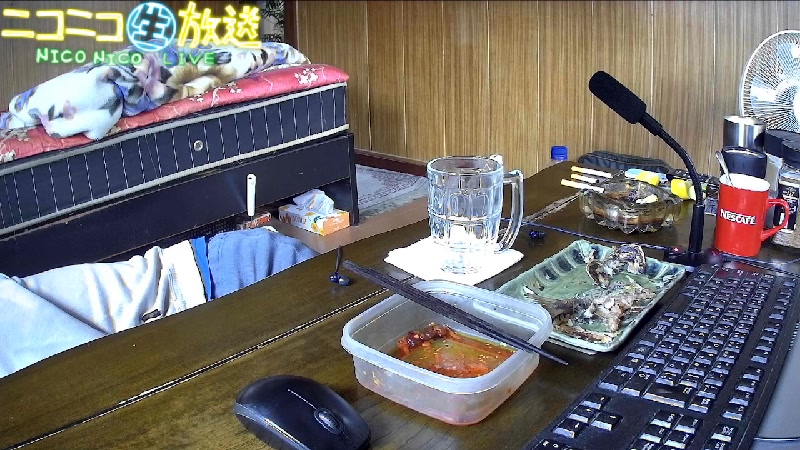
Locate an element on the screen. The width and height of the screenshot is (800, 450). keyboard is located at coordinates (718, 337).